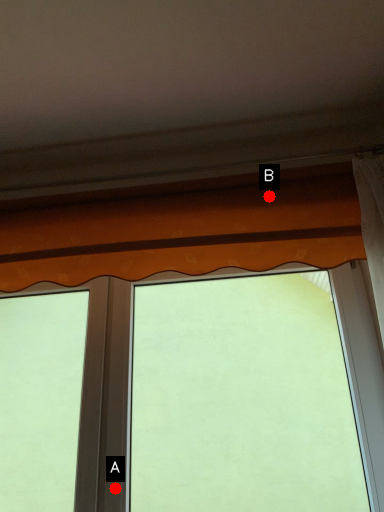
Question: Two points are circled on the image, labeled by A and B beside each circle. Which of the following is the closest to the observer?

Choices:
 (A) A is closer
 (B) B is closer

Answer: (A)